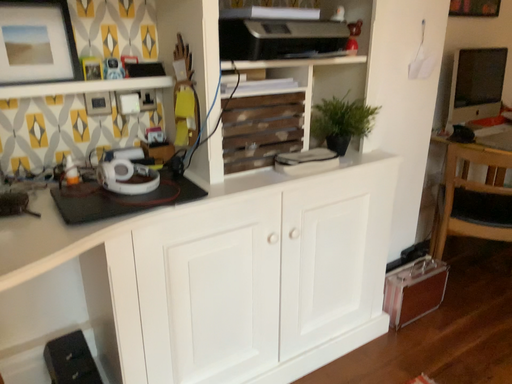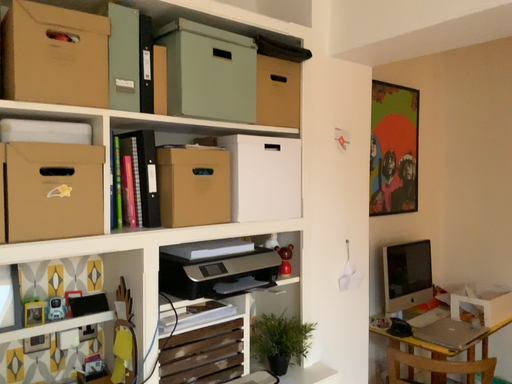
Question: How did the camera likely rotate when shooting the video?

Choices:
 (A) rotated downward
 (B) rotated upward

Answer: (B)